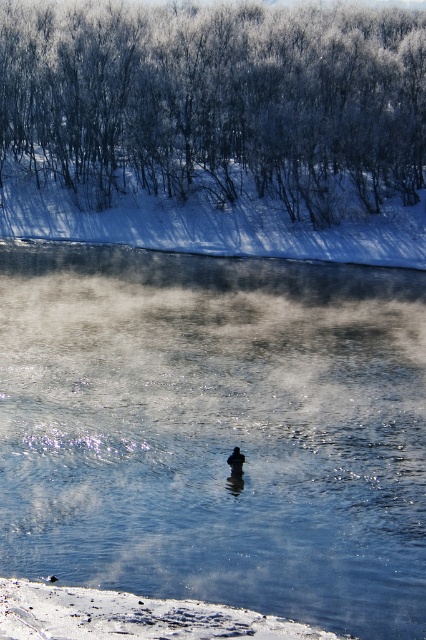
Question: Can you confirm if clear ice water at center is positioned above dark brown duck at center?

Choices:
 (A) no
 (B) yes

Answer: (B)

Question: Which of the following is the farthest from the observer?

Choices:
 (A) dark brown duck at center
 (B) clear ice water at center

Answer: (A)

Question: Is clear ice water at center bigger than snowy branches at upper center?

Choices:
 (A) yes
 (B) no

Answer: (B)

Question: Which object appears farthest from the camera in this image?

Choices:
 (A) snowy branches at upper center
 (B) clear ice water at center
 (C) dark brown duck at center

Answer: (A)

Question: Which is nearer to the snowy branches at upper center?

Choices:
 (A) dark brown duck at center
 (B) clear ice water at center

Answer: (B)

Question: Is clear ice water at center in front of dark brown duck at center?

Choices:
 (A) yes
 (B) no

Answer: (A)